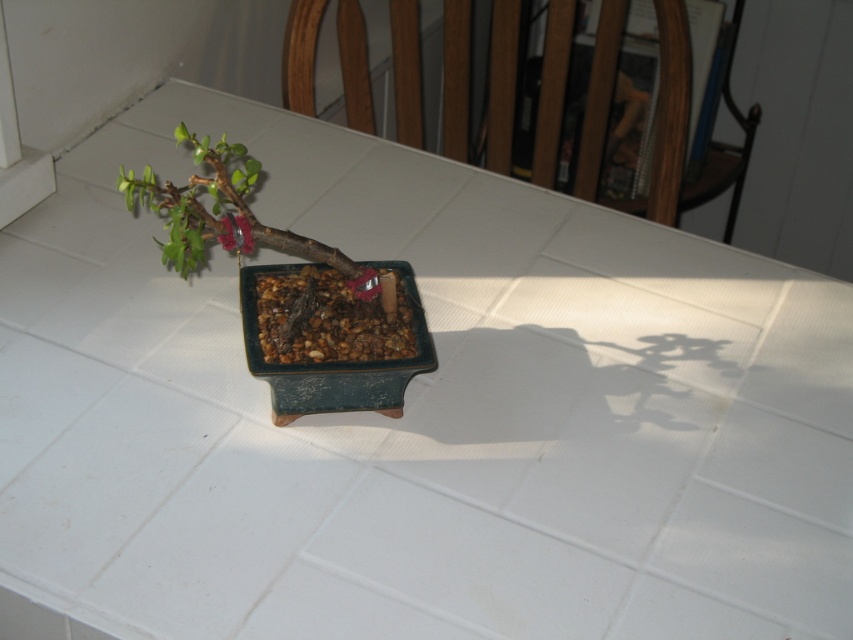
You are standing in front of the bonsai tree and want to know how far you are from the point marked as point (143, 196). Can you determine the distance?

Point (143, 196) is 1.09 meters away from the camera, so you are 1.09 meters away from the point marked as point (143, 196).

You are a gardener who needs to water both the green matte bonsai at center and the matte green flower at upper left. You have a watering can with a 6 inch long spout. Without moving the plants, can you reach both plants from your current position using the watering can?

The green matte bonsai at center is 4.72 inches away from the matte green flower at upper left. Since the watering can has a 6 inch spout, which is longer than the distance between them, you can reach both plants without moving them.

From the picture: What is the spatial relationship between the green matte bonsai at center and the matte green flower at upper left in the image?

The green matte bonsai at center is located to the left of the matte green flower at upper left.